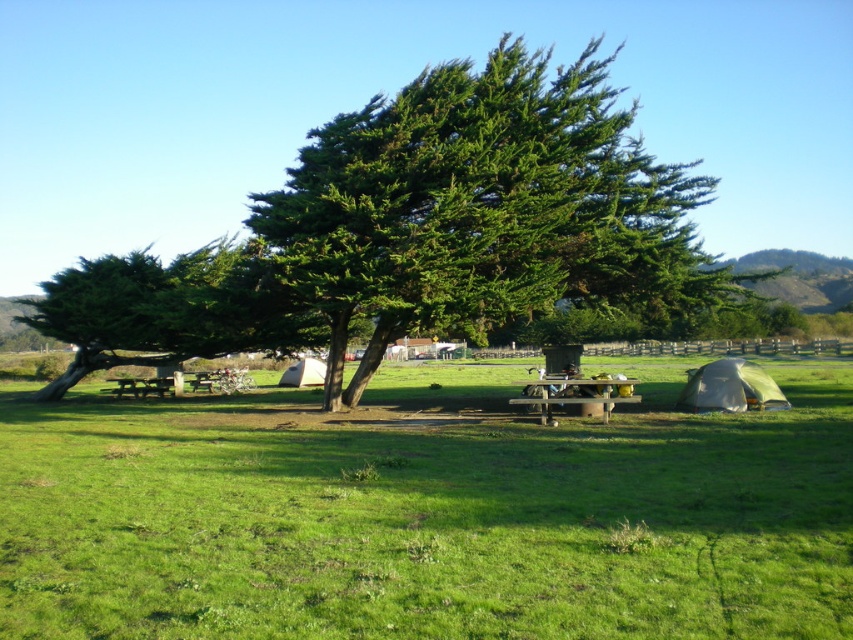
Which is below, green leafy tree at center or wooden picnic table at center?

wooden picnic table at center is lower down.

Who is higher up, green leafy tree at center or wooden picnic table at center?

green leafy tree at center is higher up.

Identify the location of green leafy tree at center. (416, 230).

Consider the image. Is green grassy field at center positioned at the back of green leafy tree at center?

That is False.

Does green grassy field at center have a smaller size compared to green leafy tree at center?

Yes.

Where is `green grassy field at center`? The height and width of the screenshot is (640, 853). green grassy field at center is located at coordinates (428, 513).

Is green leafy tree at center further to the viewer compared to white canvas tent at center?

That is False.

Which is more to the right, green leafy tree at center or white canvas tent at center?

Positioned to the right is green leafy tree at center.

Does point (73, 362) come in front of point (308, 369)?

Yes, it is in front of point (308, 369).

In order to click on green leafy tree at center in this screenshot , I will do `click(416, 230)`.